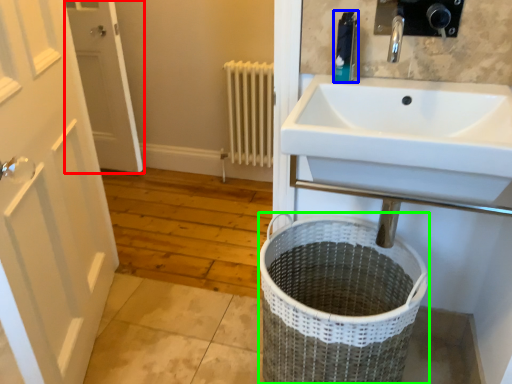
Question: Which object is the closest to the door (highlighted by a red box)? Choose among these: toiletry (highlighted by a blue box) or laundry basket (highlighted by a green box).

Choices:
 (A) toiletry
 (B) laundry basket

Answer: (B)